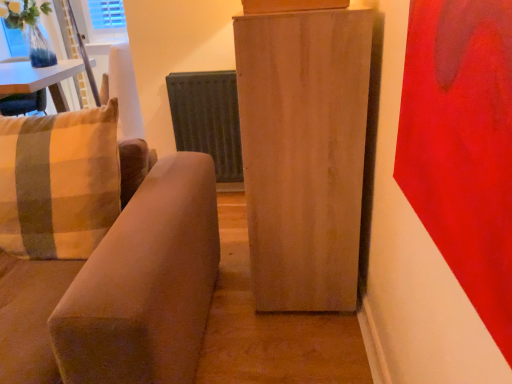
Question: Is plaid fabric pillow at left wider than metallic gray radiator at center?

Choices:
 (A) no
 (B) yes

Answer: (B)

Question: Is plaid fabric pillow at left thinner than metallic gray radiator at center?

Choices:
 (A) no
 (B) yes

Answer: (A)

Question: Does plaid fabric pillow at left lie behind metallic gray radiator at center?

Choices:
 (A) yes
 (B) no

Answer: (B)

Question: Considering the relative sizes of plaid fabric pillow at left and metallic gray radiator at center in the image provided, is plaid fabric pillow at left taller than metallic gray radiator at center?

Choices:
 (A) no
 (B) yes

Answer: (A)

Question: From a real-world perspective, is plaid fabric pillow at left physically above metallic gray radiator at center?

Choices:
 (A) no
 (B) yes

Answer: (B)

Question: Is plaid fabric pillow at left smaller than metallic gray radiator at center?

Choices:
 (A) no
 (B) yes

Answer: (A)

Question: Is suede-like beige couch at left positioned behind plaid fabric pillow at left?

Choices:
 (A) yes
 (B) no

Answer: (B)

Question: Considering the relative sizes of suede-like beige couch at left and plaid fabric pillow at left in the image provided, is suede-like beige couch at left thinner than plaid fabric pillow at left?

Choices:
 (A) no
 (B) yes

Answer: (A)

Question: Is suede-like beige couch at left with plaid fabric pillow at left?

Choices:
 (A) yes
 (B) no

Answer: (B)

Question: Can you confirm if suede-like beige couch at left is shorter than plaid fabric pillow at left?

Choices:
 (A) no
 (B) yes

Answer: (A)

Question: Does suede-like beige couch at left have a smaller size compared to plaid fabric pillow at left?

Choices:
 (A) no
 (B) yes

Answer: (A)

Question: Is suede-like beige couch at left at the right side of plaid fabric pillow at left?

Choices:
 (A) yes
 (B) no

Answer: (B)

Question: Is light wood cabinet at center looking in the opposite direction of plaid fabric pillow at left?

Choices:
 (A) no
 (B) yes

Answer: (A)